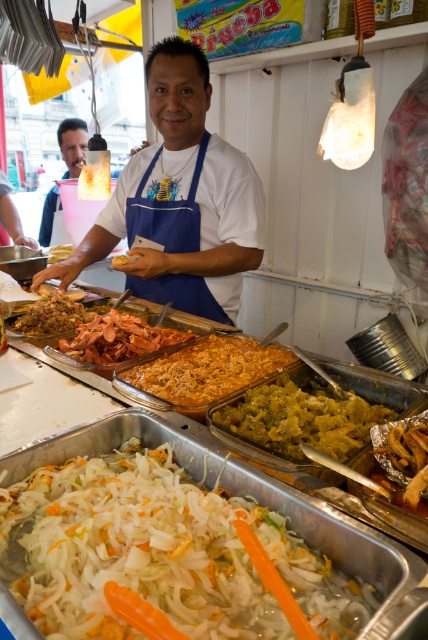
Image resolution: width=428 pixels, height=640 pixels. Find the location of `white matte apron at center`. white matte apron at center is located at coordinates (181, 200).

Can you confirm if white matte apron at center is positioned above white translucent plastic tray at center?

Yes.

What do you see at coordinates (181, 200) in the screenshot? This screenshot has width=428, height=640. I see `white matte apron at center` at bounding box center [181, 200].

Image resolution: width=428 pixels, height=640 pixels. Find the location of `white matte apron at center`. white matte apron at center is located at coordinates (181, 200).

Is white translucent shredded vegetables at center bigger than greenish-yellow shredded at center?

Yes, white translucent shredded vegetables at center is bigger than greenish-yellow shredded at center.

Which is behind, point (285, 634) or point (250, 413)?

The point (250, 413) is behind.

At what (x,y) coordinates should I click in order to perform the action: click on white translucent shredded vegetables at center. Please return your answer as a coordinate pair (x, y). The image size is (428, 640). Looking at the image, I should click on (162, 554).

This screenshot has height=640, width=428. I want to click on white translucent shredded vegetables at center, so click(162, 554).

Which is above, white translucent plastic tray at center or greenish-yellow shredded at center?

white translucent plastic tray at center is higher up.

Is white translucent plastic tray at center taller than greenish-yellow shredded at center?

Yes.

Find the location of a particular element. The height and width of the screenshot is (640, 428). white translucent plastic tray at center is located at coordinates (67, 396).